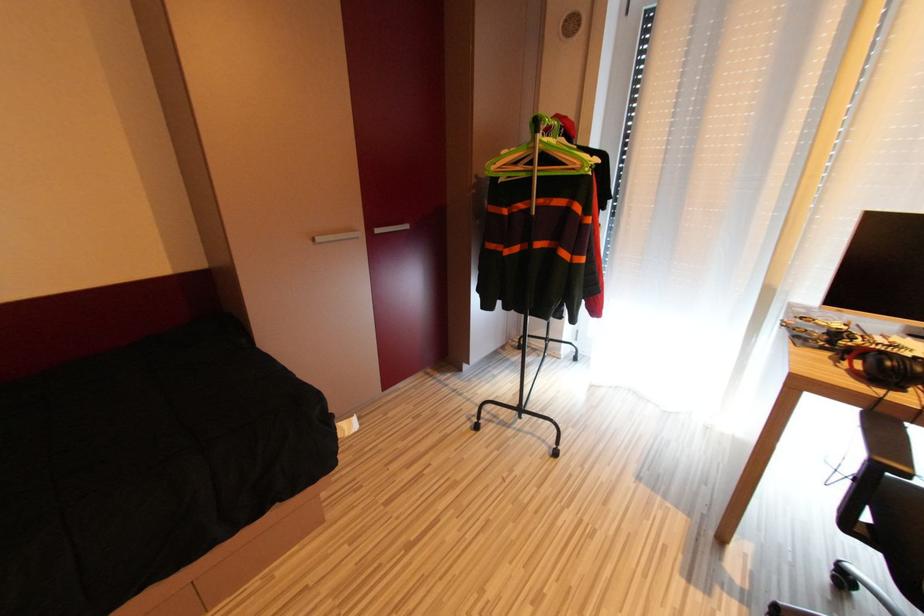
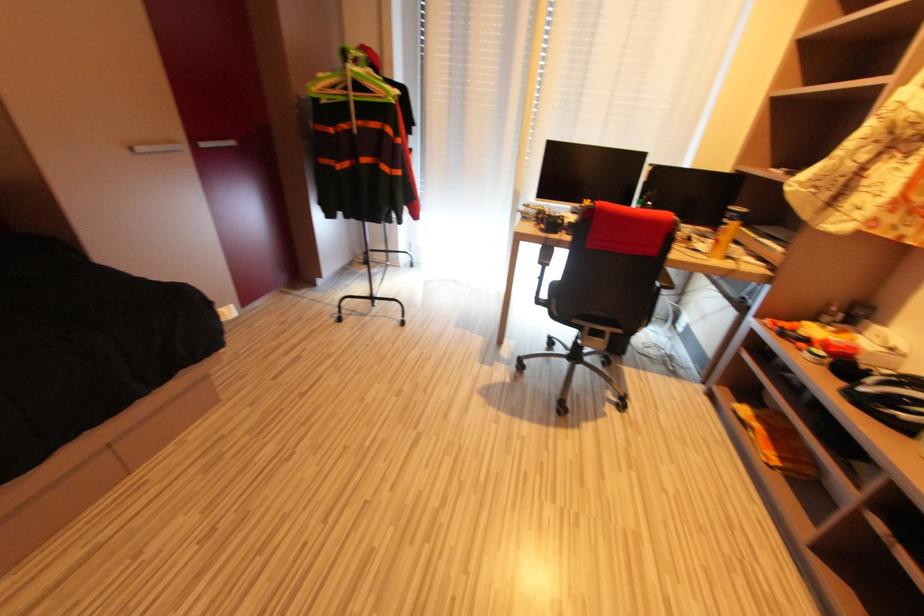
Question: The camera is either moving clockwise (left) or counter-clockwise (right) around the object. The first image is from the beginning of the video and the second image is from the end. Is the camera moving left or right when shooting the video?

Choices:
 (A) Left
 (B) Right

Answer: (A)